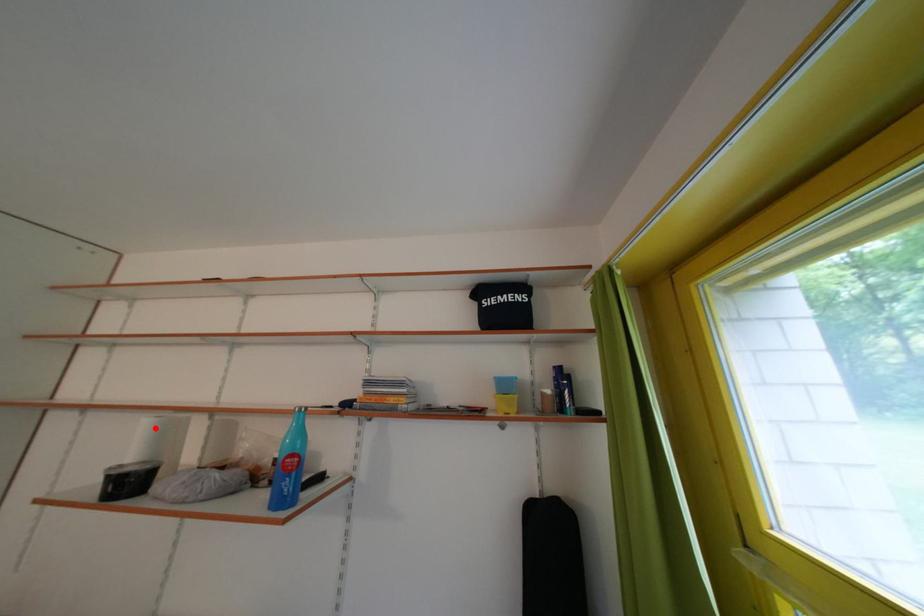
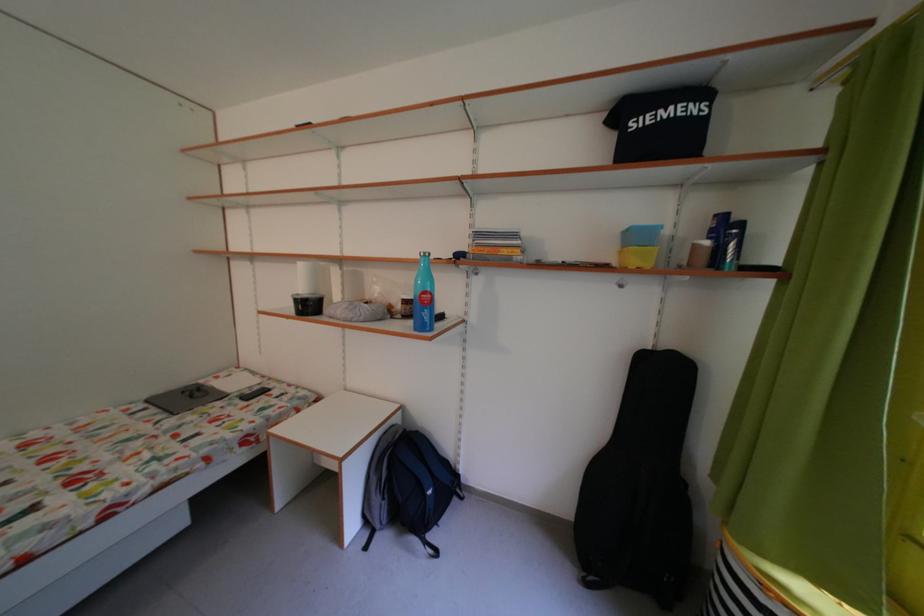
In the second image, find the point that corresponds to the highlighted location in the first image.

(311, 270)